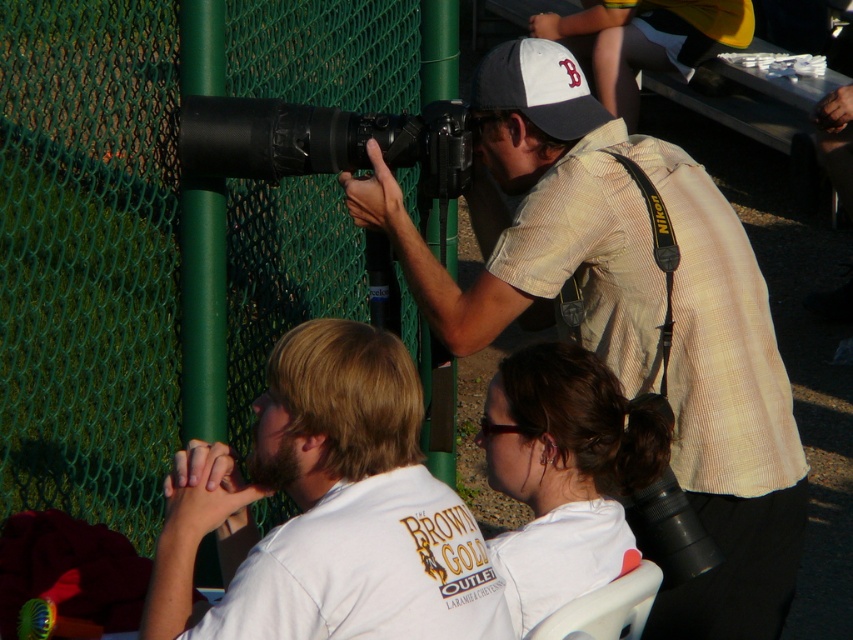
Which is more to the left, matte white shirt at center or black matte camera at center?

Positioned to the left is black matte camera at center.

Is matte white shirt at center closer to camera compared to black matte camera at center?

Yes, matte white shirt at center is closer to the viewer.

This screenshot has height=640, width=853. What do you see at coordinates (564, 474) in the screenshot?
I see `matte white shirt at center` at bounding box center [564, 474].

This screenshot has width=853, height=640. Find the location of `matte white shirt at center`. matte white shirt at center is located at coordinates (564, 474).

Can you confirm if white cotton shirt at center is smaller than white fabric baseball cap at center?

No.

Find the location of a particular element. Image resolution: width=853 pixels, height=640 pixels. white cotton shirt at center is located at coordinates (328, 509).

Locate an element on the screen. The image size is (853, 640). white cotton shirt at center is located at coordinates (328, 509).

Which is below, matte khaki shirt at center or white cotton shirt at center?

white cotton shirt at center is below.

Is matte khaki shirt at center positioned behind white cotton shirt at center?

Yes, it is behind white cotton shirt at center.

Who is more distant from viewer, (766, 394) or (479, 596)?

The point (766, 394) is more distant.

Image resolution: width=853 pixels, height=640 pixels. I want to click on matte khaki shirt at center, so click(625, 310).